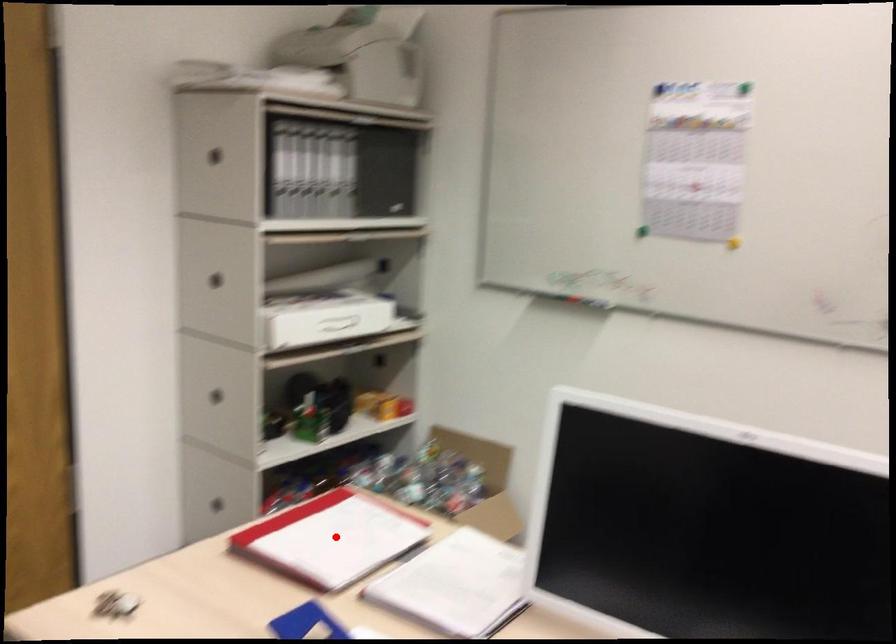
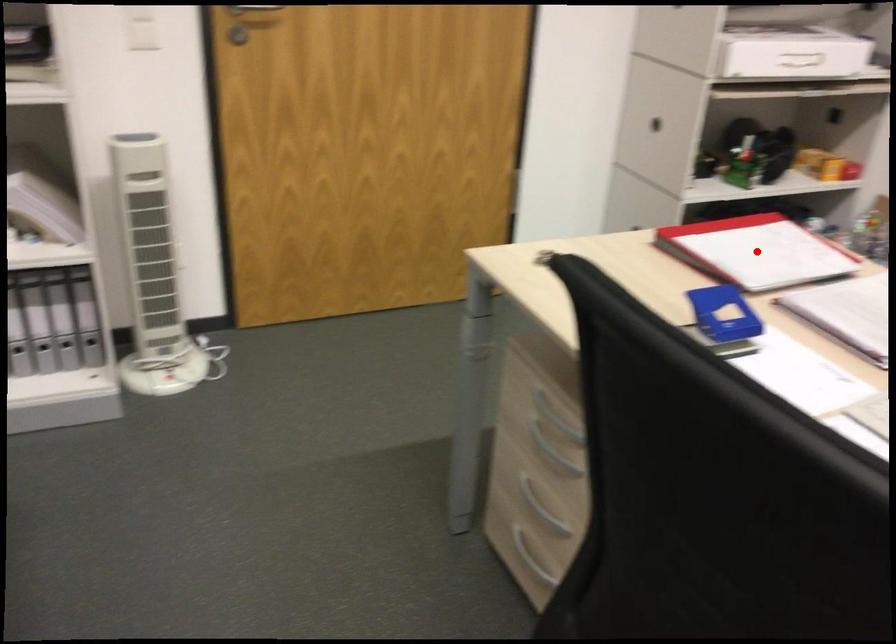
I am providing you with two images of the same scene from different viewpoints. A red point is marked on the first image and another point is marked on the second image. Is the red point in image1 aligned with the point shown in image2?

Yes